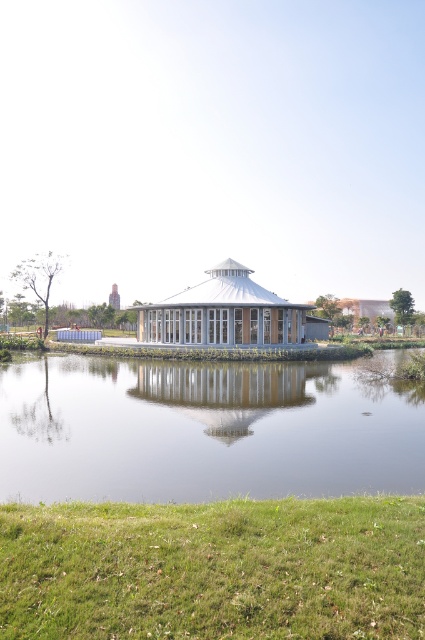
From the picture: You are standing behind the white glass gazebo at center and want to see the transparent glass pond at center. Which direction should you move to in order to have a clear view of it?

Since the transparent glass pond at center is in front of the white glass gazebo at center, you should move forward from your current position behind the white glass gazebo at center to get a clear view of the transparent glass pond at center.

You are planning to host a small gathering at the pavilion and need to set up a 3x3 meter table. Given the green grass at lower center and the transparent glass pond at center, which area is more suitable for placing the table without obstructing the view of the pond?

The transparent glass pond at center is larger than the green grass at lower center, so placing the table on the green grass at lower center would avoid obstructing the view of the pond since it is smaller and less likely to block the transparent glass pond at center.

You are standing on the path leading to the pavilion and want to cross to the other side. There is a transparent glass pond at center and a white glass gazebo at center in your way. Which object should you step around to avoid getting wet?

You should step around the transparent glass pond at center to avoid getting wet since it is to the left of the white glass gazebo at center, meaning the gazebo is on the right side. Stepping around the pond on the right side would keep you dry.